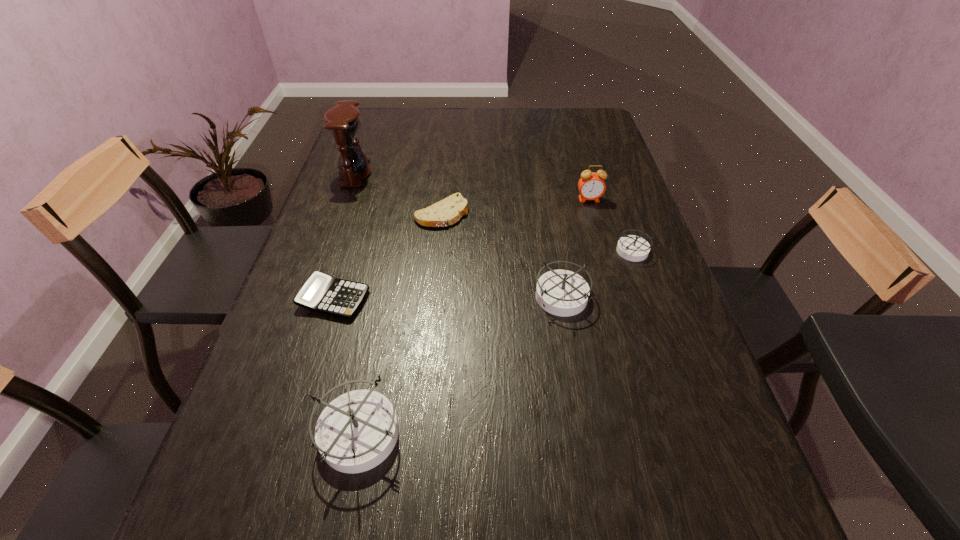
The image size is (960, 540). Identify the location of free space for an extra compass to achieve even spacing. (472, 356).